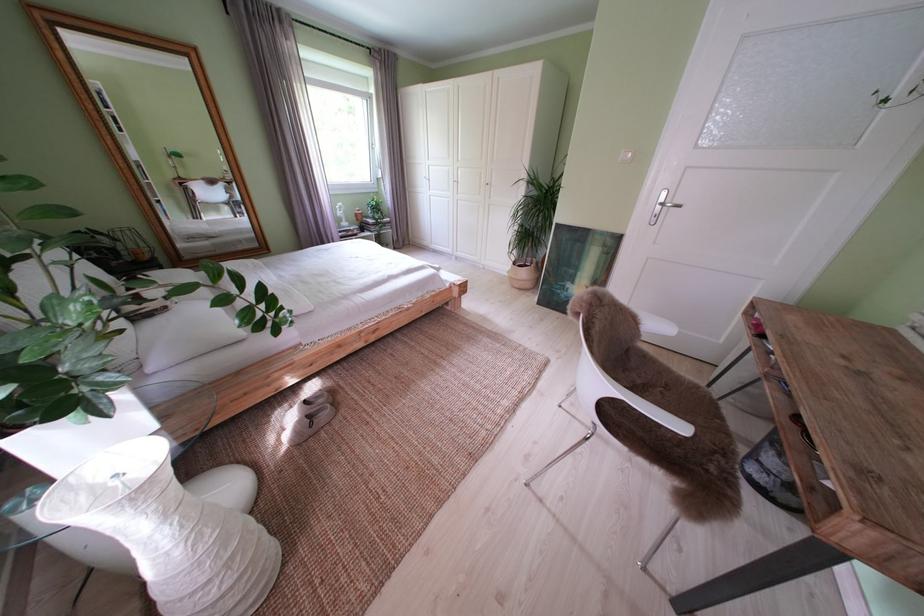
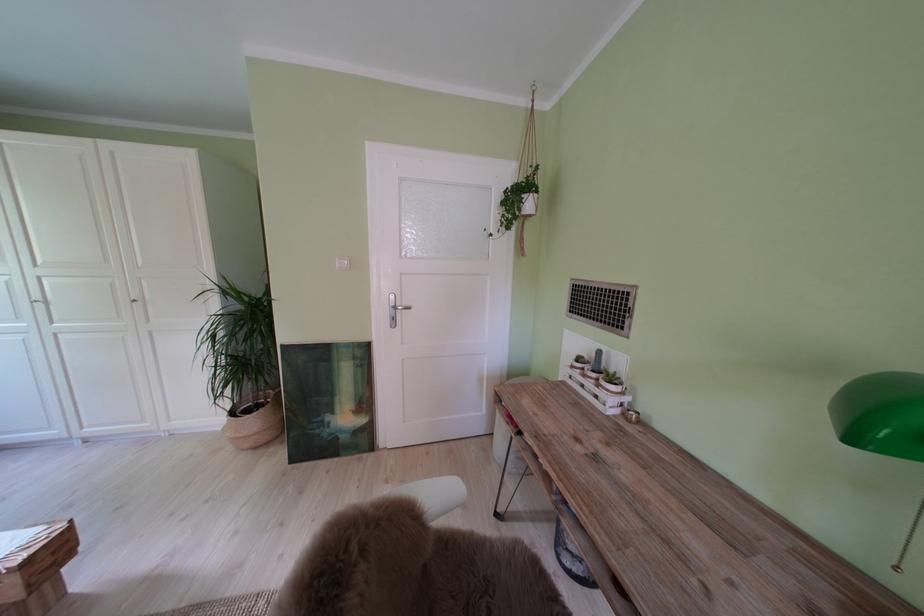
Where in the second image is the point corresponding to (526,269) from the first image?

(242, 418)